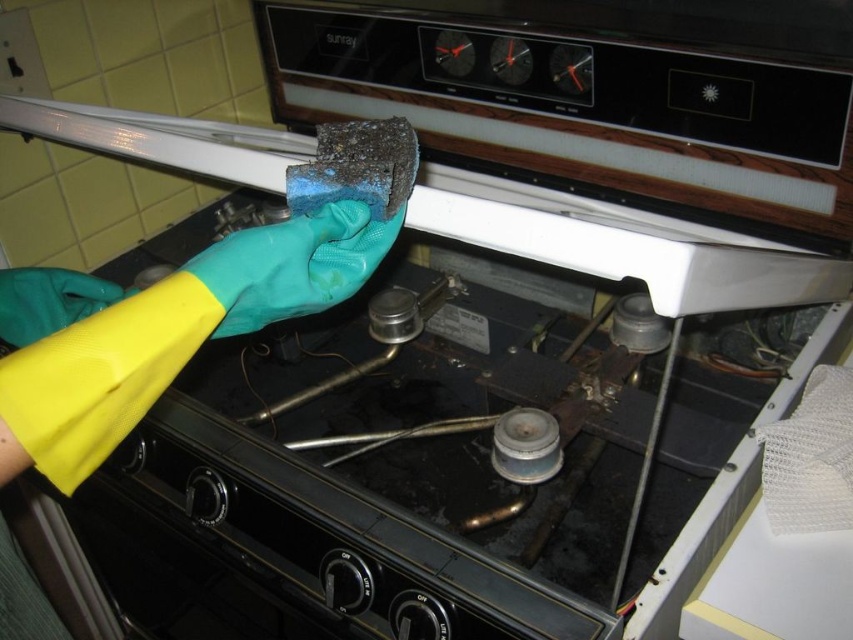
Question: Can you confirm if yellow rubber glove at lower left is smaller than blue rubber glove at center?

Choices:
 (A) no
 (B) yes

Answer: (B)

Question: Among these points, which one is nearest to the camera?

Choices:
 (A) (212, 248)
 (B) (120, 417)

Answer: (B)

Question: Among these objects, which one is nearest to the camera?

Choices:
 (A) blue rubber glove at center
 (B) yellow rubber glove at lower left

Answer: (B)

Question: Is the position of yellow rubber glove at lower left more distant than that of blue rubber glove at center?

Choices:
 (A) yes
 (B) no

Answer: (B)

Question: Does yellow rubber glove at lower left have a larger size compared to blue rubber glove at center?

Choices:
 (A) yes
 (B) no

Answer: (B)

Question: Which of the following is the closest to the observer?

Choices:
 (A) click(x=65, y=417)
 (B) click(x=289, y=296)

Answer: (A)